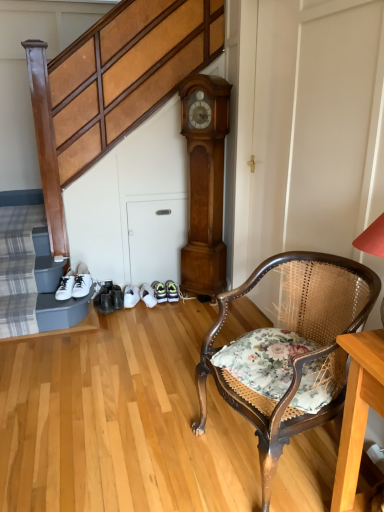
Question: From a real-world perspective, is floral fabric cushion at lower right over light brown wood clock at center?

Choices:
 (A) no
 (B) yes

Answer: (A)

Question: From a real-world perspective, is floral fabric cushion at lower right positioned under light brown wood clock at center based on gravity?

Choices:
 (A) no
 (B) yes

Answer: (B)

Question: Considering the relative sizes of floral fabric cushion at lower right and light brown wood clock at center in the image provided, is floral fabric cushion at lower right shorter than light brown wood clock at center?

Choices:
 (A) yes
 (B) no

Answer: (A)

Question: Is floral fabric cushion at lower right thinner than light brown wood clock at center?

Choices:
 (A) yes
 (B) no

Answer: (B)

Question: Are floral fabric cushion at lower right and light brown wood clock at center making contact?

Choices:
 (A) yes
 (B) no

Answer: (B)

Question: In terms of height, does light brown wood clock at center look taller or shorter compared to floral fabric cushion at lower right?

Choices:
 (A) tall
 (B) short

Answer: (A)

Question: Relative to floral fabric cushion at lower right, is light brown wood clock at center in front or behind?

Choices:
 (A) behind
 (B) front

Answer: (A)

Question: From the image's perspective, is light brown wood clock at center positioned above or below floral fabric cushion at lower right?

Choices:
 (A) above
 (B) below

Answer: (A)

Question: From a real-world perspective, is light brown wood clock at center above or below floral fabric cushion at lower right?

Choices:
 (A) below
 (B) above

Answer: (B)

Question: In terms of height, does floral fabric chair at lower right look taller or shorter compared to light brown wood clock at center?

Choices:
 (A) short
 (B) tall

Answer: (A)

Question: Based on their positions, is floral fabric chair at lower right located to the left or right of light brown wood clock at center?

Choices:
 (A) left
 (B) right

Answer: (B)

Question: Choose the correct answer: Is floral fabric chair at lower right inside light brown wood clock at center or outside it?

Choices:
 (A) outside
 (B) inside

Answer: (A)

Question: Looking at the image, does floral fabric chair at lower right seem bigger or smaller compared to light brown wood clock at center?

Choices:
 (A) small
 (B) big

Answer: (B)

Question: In terms of width, does light brown wood clock at center look wider or thinner when compared to shiny black shoe at lower center?

Choices:
 (A) thin
 (B) wide

Answer: (B)

Question: In the image, is light brown wood clock at center on the left side or the right side of shiny black shoe at lower center?

Choices:
 (A) right
 (B) left

Answer: (A)